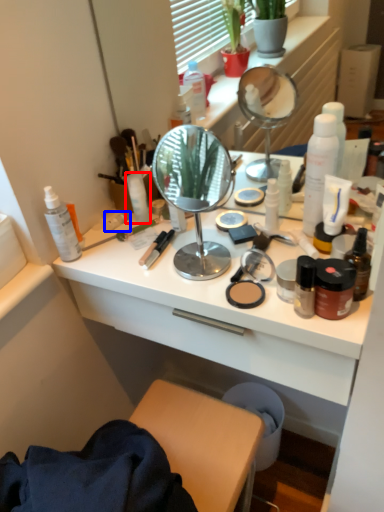
Question: Which object is closer to the camera taking this photo, toiletry (highlighted by a red box) or toiletry (highlighted by a blue box)?

Choices:
 (A) toiletry
 (B) toiletry

Answer: (A)